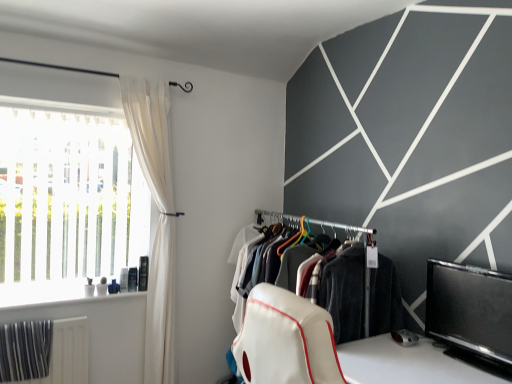
Question: Is white sheer curtain at left far away from black glossy tv at lower right?

Choices:
 (A) no
 (B) yes

Answer: (B)

Question: Is white sheer curtain at left beside black glossy tv at lower right?

Choices:
 (A) no
 (B) yes

Answer: (A)

Question: Is the position of white sheer curtain at left less distant than that of black glossy tv at lower right?

Choices:
 (A) no
 (B) yes

Answer: (A)

Question: From the image's perspective, is white sheer curtain at left above black glossy tv at lower right?

Choices:
 (A) no
 (B) yes

Answer: (B)

Question: Does white sheer curtain at left have a smaller size compared to black glossy tv at lower right?

Choices:
 (A) no
 (B) yes

Answer: (A)

Question: Considering the positions of white translucent blinds at left and white sheer curtain at left in the image, is white translucent blinds at left wider or thinner than white sheer curtain at left?

Choices:
 (A) thin
 (B) wide

Answer: (A)

Question: Considering the relative positions of white translucent blinds at left and white sheer curtain at left in the image provided, is white translucent blinds at left to the left or to the right of white sheer curtain at left?

Choices:
 (A) right
 (B) left

Answer: (B)

Question: Is white translucent blinds at left situated inside white sheer curtain at left or outside?

Choices:
 (A) outside
 (B) inside

Answer: (A)

Question: In the image, is white translucent blinds at left positioned in front of or behind white sheer curtain at left?

Choices:
 (A) behind
 (B) front

Answer: (B)

Question: Is white sheer curtain at left spatially inside black glossy tv at lower right, or outside of it?

Choices:
 (A) outside
 (B) inside

Answer: (A)

Question: Is white sheer curtain at left bigger or smaller than black glossy tv at lower right?

Choices:
 (A) big
 (B) small

Answer: (A)

Question: Would you say white sheer curtain at left is to the left or to the right of black glossy tv at lower right in the picture?

Choices:
 (A) right
 (B) left

Answer: (B)

Question: Does point (140, 139) appear closer or farther from the camera than point (425, 312)?

Choices:
 (A) farther
 (B) closer

Answer: (A)

Question: From a real-world perspective, is white fabric clothes at center above or below white sheer curtain at left?

Choices:
 (A) above
 (B) below

Answer: (B)

Question: Relative to white sheer curtain at left, is white fabric clothes at center in front or behind?

Choices:
 (A) behind
 (B) front

Answer: (B)